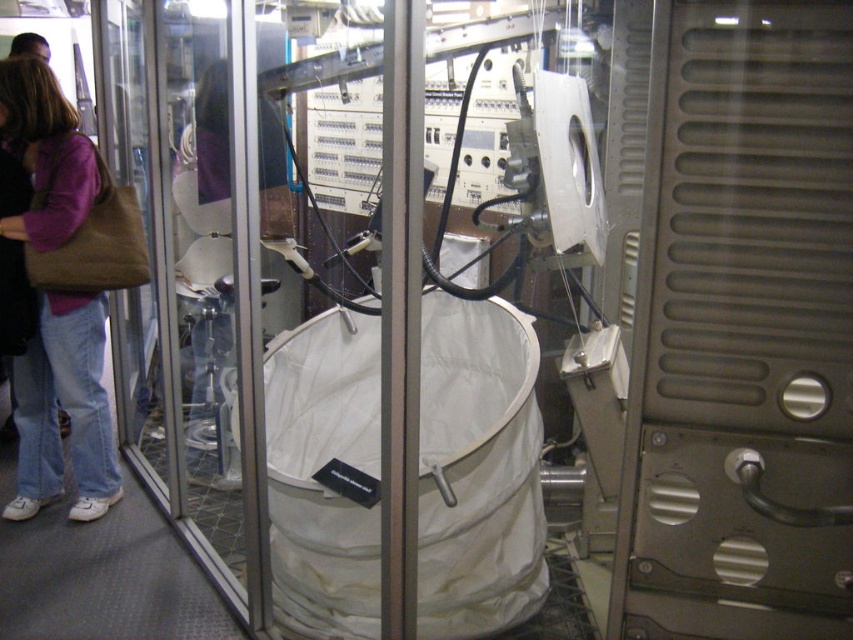
You are a security guard in the museum and need to exit the room quickly. The emergency exit is located at coordinates point 0.423, 0.233. Is the transparent glass screen door at left blocking your path to the emergency exit?

The transparent glass screen door at left is positioned at point (198, 269), which matches the coordinates of the emergency exit. Therefore, the transparent glass screen door at left is likely the emergency exit door and would not block your path but rather be the path to exit.

You are an art handler carrying the matte brown bag at left and need to pass through the transparent glass screen door at left. Will the bag fit through the door without being damaged?

The transparent glass screen door at left is wider than the matte brown bag at left, so the bag will fit through the door without any issues.